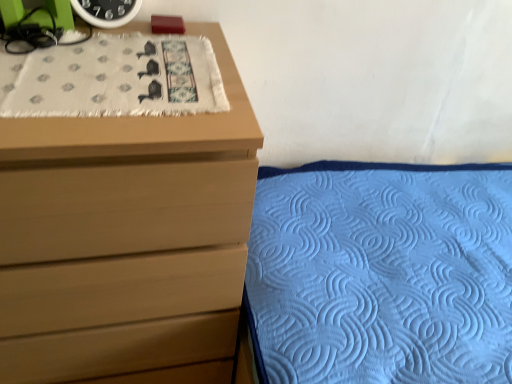
Locate an element on the screen. blank space situated above matte wood chest of drawers at upper left (from a real-world perspective) is located at coordinates (87, 64).